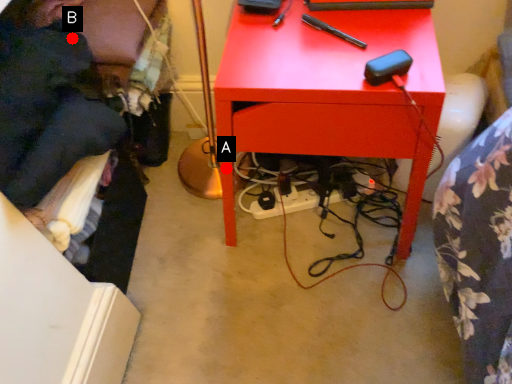
Question: Two points are circled on the image, labeled by A and B beside each circle. Which point is farther to the camera?

Choices:
 (A) A is further
 (B) B is further

Answer: (A)